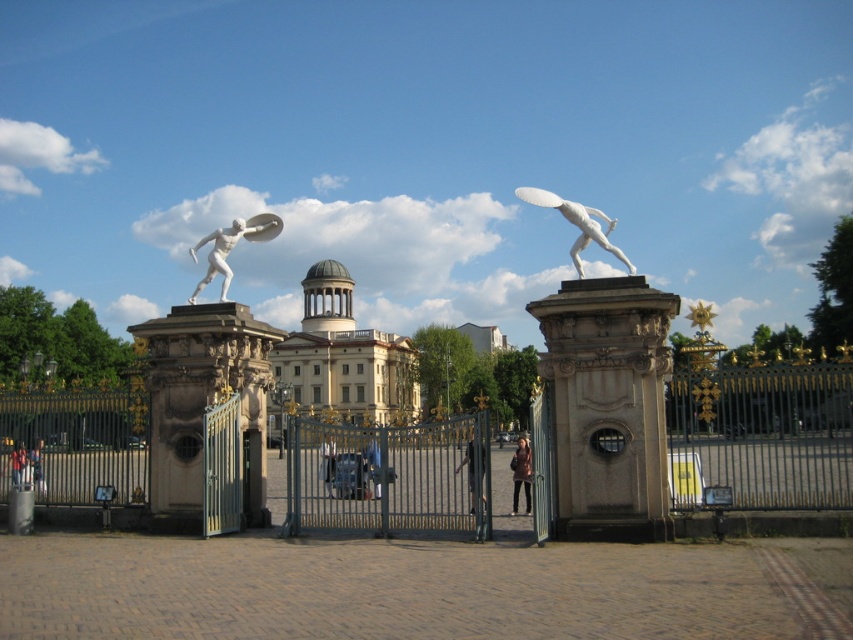
At what (x,y) coordinates should I click in order to perform the action: click on gold metallic fence at center. Please return your answer as a coordinate pair (x, y). The width and height of the screenshot is (853, 640). Looking at the image, I should click on (762, 435).

Between gold metallic fence at center and dark brown leather jacket at center, which one is positioned lower?

gold metallic fence at center is lower down.

This screenshot has height=640, width=853. What do you see at coordinates (762, 435) in the screenshot? I see `gold metallic fence at center` at bounding box center [762, 435].

In order to click on gold metallic fence at center in this screenshot , I will do `click(762, 435)`.

Who is more distant from viewer, (369, 525) or (531, 477)?

The point (531, 477) is more distant.

Is the position of metallic/golden gate at center more distant than that of matte pink coat at center?

No, metallic/golden gate at center is in front of matte pink coat at center.

The height and width of the screenshot is (640, 853). What do you see at coordinates (390, 477) in the screenshot? I see `metallic/golden gate at center` at bounding box center [390, 477].

Where is `metallic/golden gate at center`? Image resolution: width=853 pixels, height=640 pixels. metallic/golden gate at center is located at coordinates (390, 477).

Looking at this image, who is taller, dark brown leather jacket at center or dark brown leather jacket at lower left?

dark brown leather jacket at center

Does point (469, 492) lie in front of point (41, 444)?

Yes, it is in front of point (41, 444).

The width and height of the screenshot is (853, 640). What are the coordinates of `dark brown leather jacket at center` in the screenshot? It's located at (473, 468).